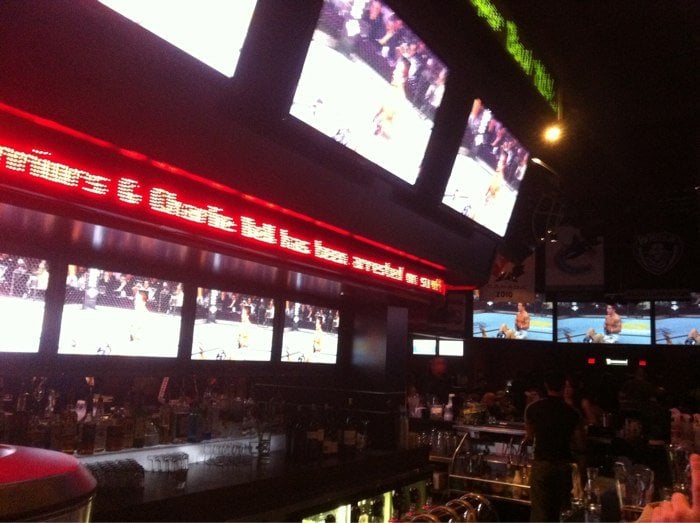
This screenshot has width=700, height=523. In order to click on glass in this screenshot , I will do `click(626, 487)`.